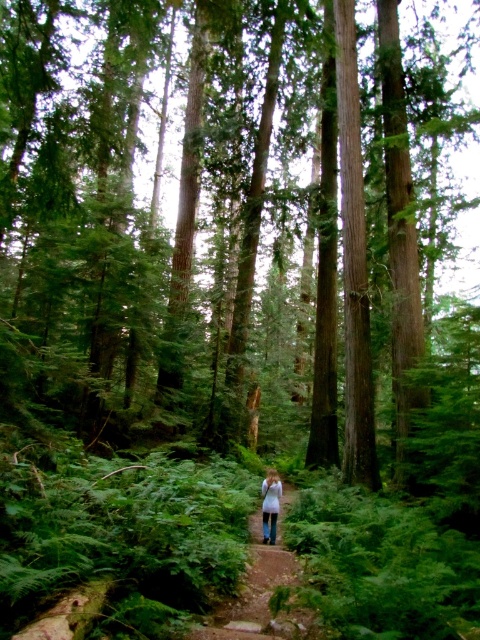
Question: Is white fabric at center to the right of white cotton shirt at center from the viewer's perspective?

Choices:
 (A) yes
 (B) no

Answer: (B)

Question: Where is white fabric at center located in relation to white cotton shirt at center in the image?

Choices:
 (A) right
 (B) left

Answer: (B)

Question: Among these points, which one is nearest to the camera?

Choices:
 (A) (264, 497)
 (B) (247, 609)

Answer: (B)

Question: Which object appears farthest from the camera in this image?

Choices:
 (A) white fabric at center
 (B) white cotton shirt at center

Answer: (B)

Question: Can you confirm if white fabric at center is positioned to the right of white cotton shirt at center?

Choices:
 (A) no
 (B) yes

Answer: (A)

Question: Among these points, which one is farthest from the camera?

Choices:
 (A) (304, 634)
 (B) (271, 520)

Answer: (B)